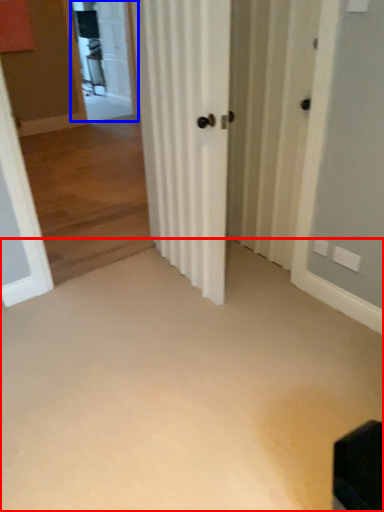
Question: Which object is further to the camera taking this photo, corridor (highlighted by a red box) or screen door (highlighted by a blue box)?

Choices:
 (A) corridor
 (B) screen door

Answer: (B)